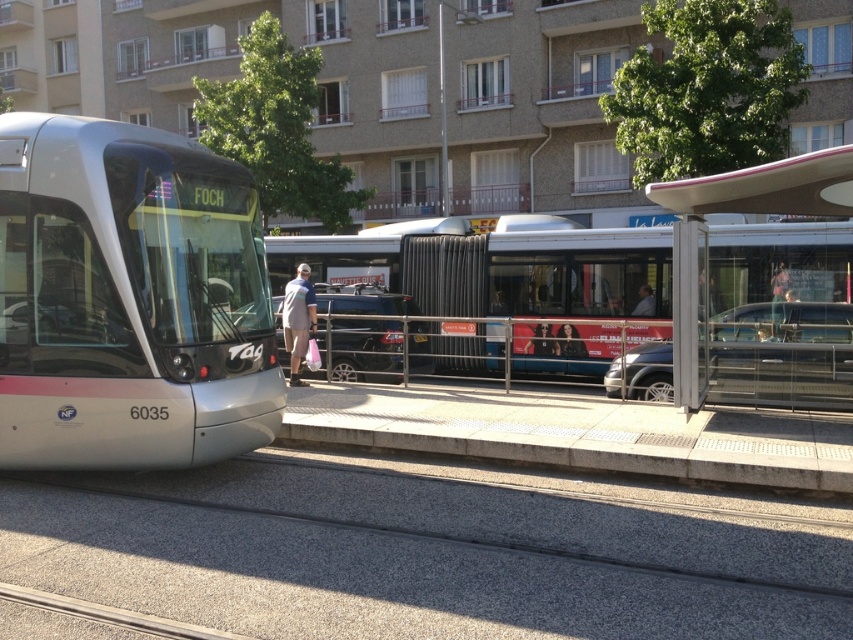
Question: Can you confirm if transparent glass bus stop at center is positioned to the right of gray fabric bag at center?

Choices:
 (A) yes
 (B) no

Answer: (A)

Question: Does transparent glass bus stop at center lie in front of gray fabric bag at center?

Choices:
 (A) yes
 (B) no

Answer: (A)

Question: Is silver metallic tram at left positioned before gray fabric bag at center?

Choices:
 (A) no
 (B) yes

Answer: (B)

Question: Which object is positioned closest to the gray fabric bag at center?

Choices:
 (A) transparent glass bus stop at center
 (B) dark brown hair at center

Answer: (A)

Question: Which object appears farthest from the camera in this image?

Choices:
 (A) transparent glass bus stop at center
 (B) light brown leather jacket at center
 (C) dark brown hair at center

Answer: (C)

Question: Which point appears closest to the camera in this image?

Choices:
 (A) (316, 321)
 (B) (560, 332)

Answer: (A)